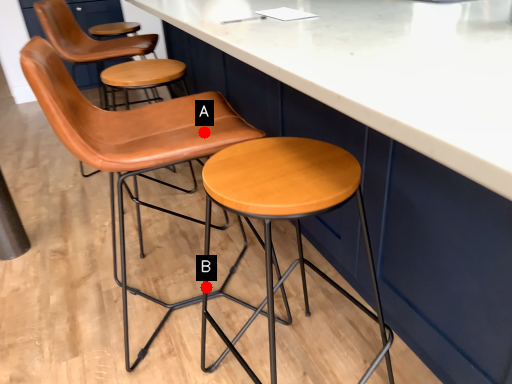
Question: Two points are circled on the image, labeled by A and B beside each circle. Which point appears farthest from the camera in this image?

Choices:
 (A) A is further
 (B) B is further

Answer: (B)